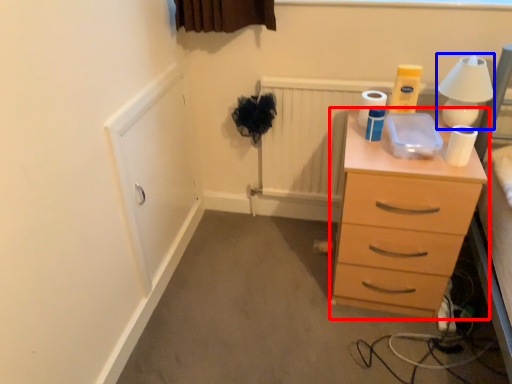
Question: Which object appears closest to the camera in this image, chest of drawers (highlighted by a red box) or table lamp (highlighted by a blue box)?

Choices:
 (A) chest of drawers
 (B) table lamp

Answer: (A)